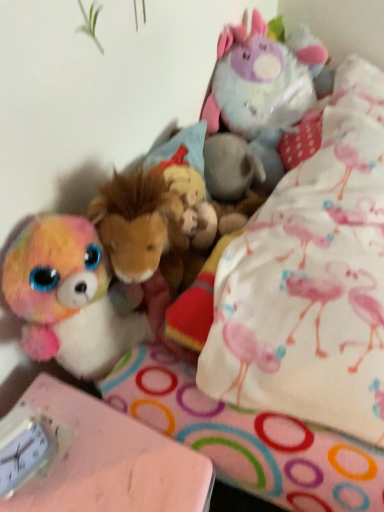
Question: Is fluffy plush unicorn at upper right shorter than pink matte table at lower left?

Choices:
 (A) no
 (B) yes

Answer: (B)

Question: Does fluffy plush unicorn at upper right come in front of pink matte table at lower left?

Choices:
 (A) yes
 (B) no

Answer: (B)

Question: Considering the relative sizes of fluffy plush unicorn at upper right and pink matte table at lower left in the image provided, is fluffy plush unicorn at upper right taller than pink matte table at lower left?

Choices:
 (A) yes
 (B) no

Answer: (B)

Question: From a real-world perspective, is fluffy plush unicorn at upper right beneath pink matte table at lower left?

Choices:
 (A) no
 (B) yes

Answer: (A)

Question: From the image's perspective, is fluffy plush unicorn at upper right located above pink matte table at lower left?

Choices:
 (A) no
 (B) yes

Answer: (B)

Question: From a real-world perspective, relative to white plastic clock at lower left, is fluffy plush unicorn at upper right vertically above or below?

Choices:
 (A) below
 (B) above

Answer: (B)

Question: From the image's perspective, is fluffy plush unicorn at upper right located above or below white plastic clock at lower left?

Choices:
 (A) below
 (B) above

Answer: (B)

Question: Is fluffy plush unicorn at upper right spatially inside white plastic clock at lower left, or outside of it?

Choices:
 (A) outside
 (B) inside

Answer: (A)

Question: Considering the positions of fluffy plush unicorn at upper right and white plastic clock at lower left in the image, is fluffy plush unicorn at upper right taller or shorter than white plastic clock at lower left?

Choices:
 (A) tall
 (B) short

Answer: (A)

Question: Considering the positions of white plastic clock at lower left and fluffy plush unicorn at upper right in the image, is white plastic clock at lower left wider or thinner than fluffy plush unicorn at upper right?

Choices:
 (A) thin
 (B) wide

Answer: (A)

Question: Is white plastic clock at lower left situated inside fluffy plush unicorn at upper right or outside?

Choices:
 (A) outside
 (B) inside

Answer: (A)

Question: In the image, is white plastic clock at lower left positioned in front of or behind fluffy plush unicorn at upper right?

Choices:
 (A) front
 (B) behind

Answer: (A)

Question: From a real-world perspective, relative to fluffy plush unicorn at upper right, is white plastic clock at lower left vertically above or below?

Choices:
 (A) below
 (B) above

Answer: (A)

Question: Considering the positions of pink matte table at lower left and fluffy plush unicorn at upper right in the image, is pink matte table at lower left wider or thinner than fluffy plush unicorn at upper right?

Choices:
 (A) wide
 (B) thin

Answer: (A)

Question: From a real-world perspective, is pink matte table at lower left above or below fluffy plush unicorn at upper right?

Choices:
 (A) below
 (B) above

Answer: (A)